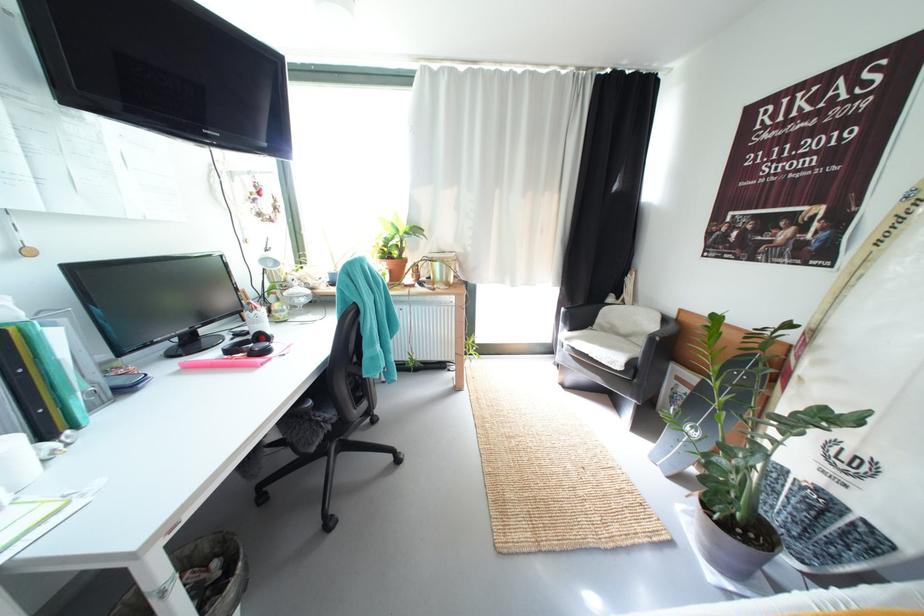
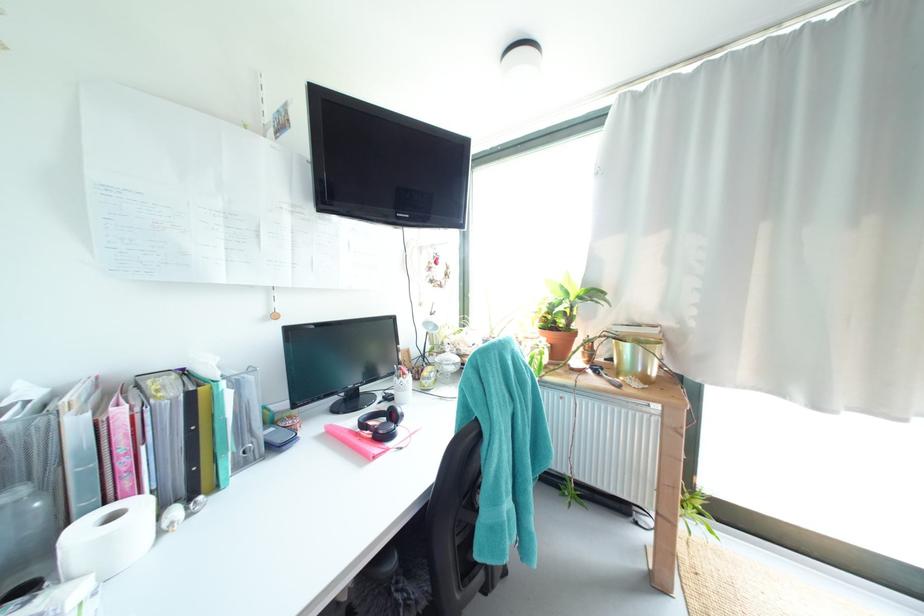
The point at (53, 448) is marked in the first image. Where is the corresponding point in the second image?

(185, 513)